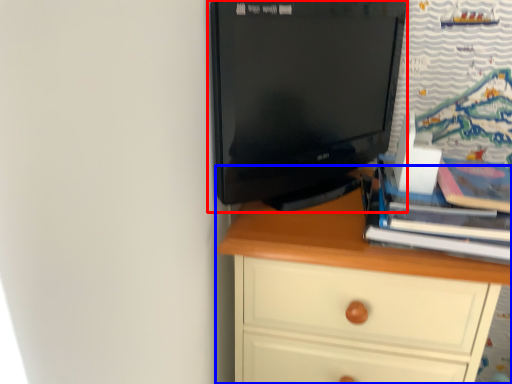
Question: Which point is further to the camera, computer monitor (highlighted by a red box) or chest of drawers (highlighted by a blue box)?

Choices:
 (A) computer monitor
 (B) chest of drawers

Answer: (B)